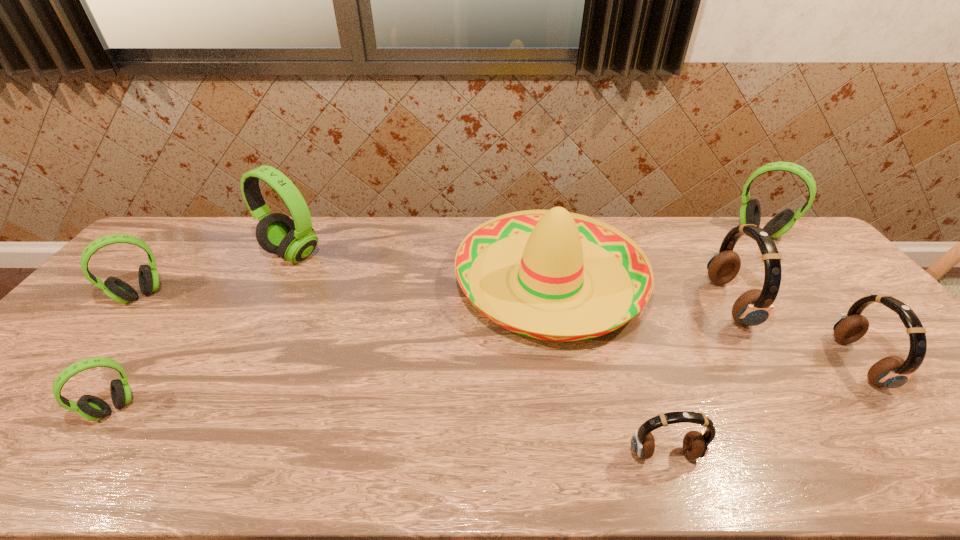
Find the location of a particular element. free space between the third smallest green headset and the red sombrero is located at coordinates (655, 256).

Locate an element on the screen. vacant area between the nearest object and the fifth headset from left to right is located at coordinates (697, 379).

I want to click on free space between the red sombrero and the smallest brown headset, so click(608, 367).

Identify which object is located as the second nearest to the third object from right to left. Please provide its 2D coordinates. Your answer should be formatted as a tuple, i.e. [(x, y)], where the tuple contains the x and y coordinates of a point satisfying the conditions above.

[(555, 247)]

Image resolution: width=960 pixels, height=540 pixels. Identify the location of object that ranks as the seventh closest to the third object from left to right. (890, 372).

At what (x,y) coordinates should I click in order to perform the action: click on the closest headset to the sombrero. Please return your answer as a coordinate pair (x, y). Looking at the image, I should click on (754, 307).

The image size is (960, 540). In order to click on headset that is the third nearest to the second smallest brown headset in this screenshot , I will do `click(696, 444)`.

Locate an element on the screen. The image size is (960, 540). green headset object that ranks as the closest to the third green headset from left to right is located at coordinates (118, 290).

You are a GUI agent. You are given a task and a screenshot of the screen. Output one action in this format:
    pyautogui.click(x=<x>, y=<y>)
    Task: Click on the third closest green headset to the rightmost green headset
    Image resolution: width=960 pixels, height=540 pixels.
    Given the screenshot: What is the action you would take?
    pyautogui.click(x=118, y=290)

Choose which brown headset is the second nearest neighbor to the rightmost brown headset. Please provide its 2D coordinates. Your answer should be formatted as a tuple, i.e. [(x, y)], where the tuple contains the x and y coordinates of a point satisfying the conditions above.

[(696, 444)]